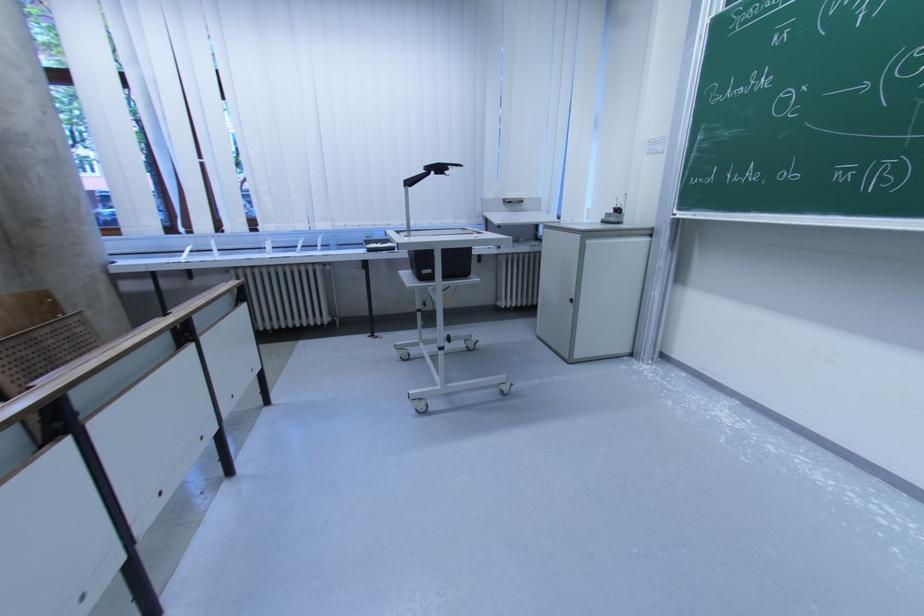
The image size is (924, 616). What do you see at coordinates (570, 300) in the screenshot?
I see `the cabinet door handle` at bounding box center [570, 300].